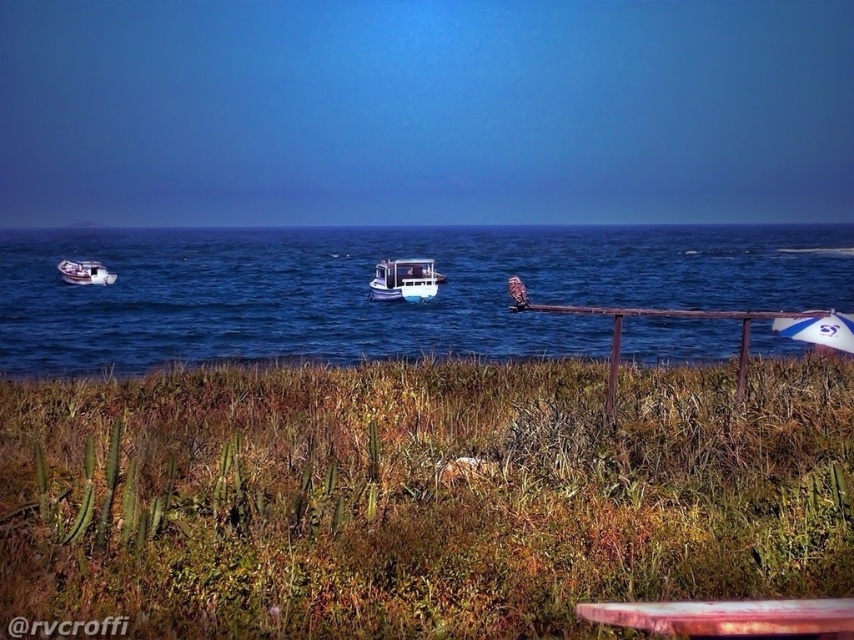
Can you confirm if green grassy at lower center is thinner than rusty metal picnic table at lower right?

No, green grassy at lower center is not thinner than rusty metal picnic table at lower right.

The image size is (854, 640). What are the coordinates of `green grassy at lower center` in the screenshot? It's located at (417, 496).

This screenshot has height=640, width=854. Identify the location of green grassy at lower center. (417, 496).

Who is more forward, (x=451, y=589) or (x=401, y=285)?

Point (x=451, y=589) is more forward.

Is green grassy at lower center further to the viewer compared to white glossy boat at center?

No.

Is point (44, 483) less distant than point (401, 296)?

Yes, point (44, 483) is in front of point (401, 296).

Locate an element on the screen. This screenshot has width=854, height=640. green grassy at lower center is located at coordinates (417, 496).

Which is more to the right, green grassy at lower center or metallic silver boat at left?

Positioned to the right is green grassy at lower center.

Is point (209, 515) behind point (91, 282)?

That is False.

Who is more forward, (535, 408) or (89, 284)?

Point (535, 408) is in front.

Locate an element on the screen. Image resolution: width=854 pixels, height=640 pixels. green grassy at lower center is located at coordinates (417, 496).